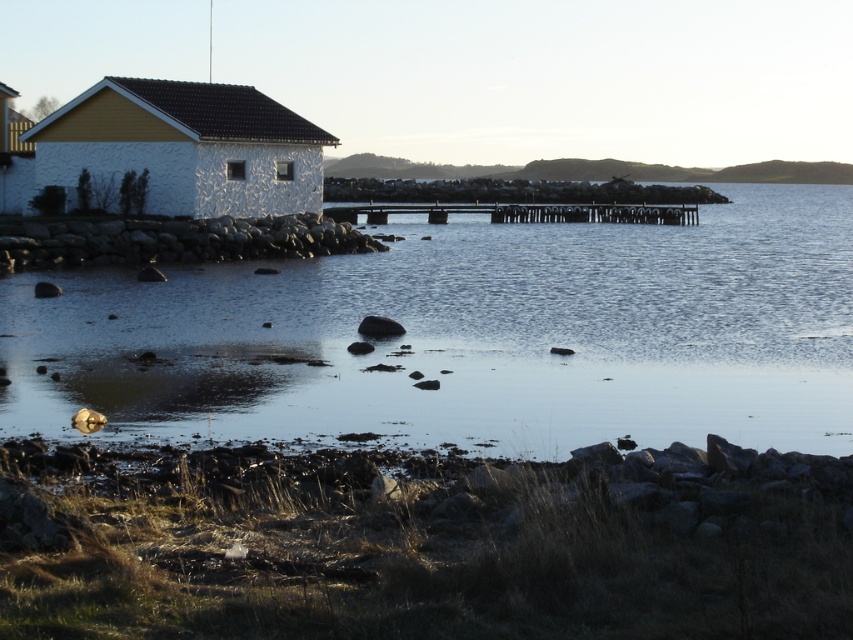
You are standing at the edge of the rocky shoreline and see the gray rock at lower left and the smooth gray rock at center. Which rock is closer to your left side?

The gray rock at lower left is closer to your left side because it is positioned on the left side of the smooth gray rock at center.